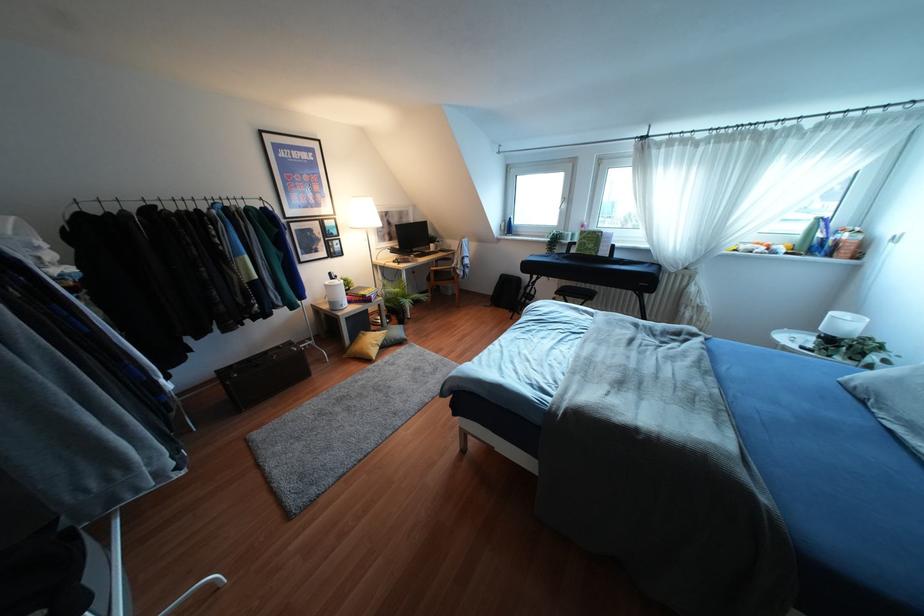
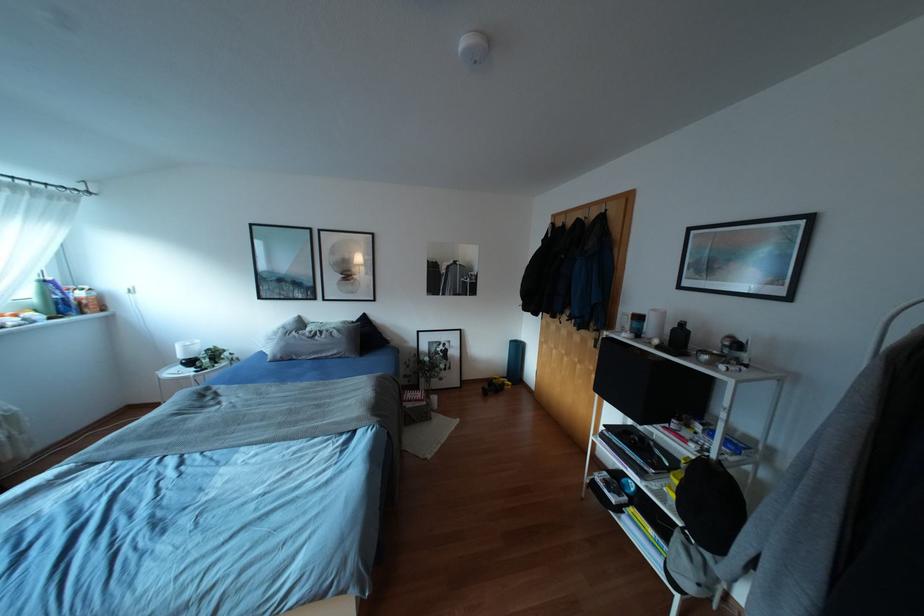
Find the pixel in the second image that matches point 798,236 in the first image.

(35, 301)